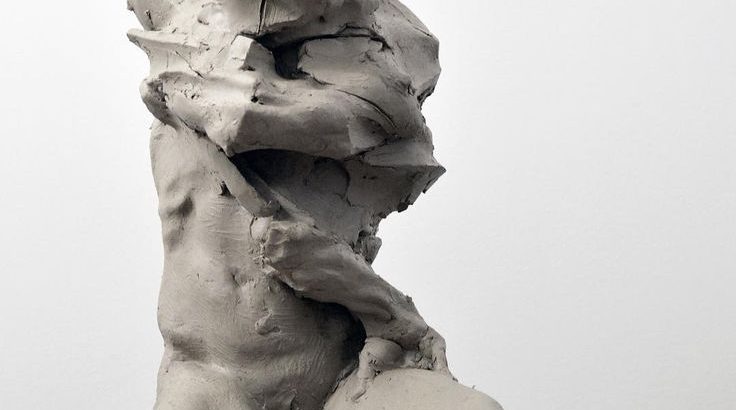
This screenshot has height=410, width=736. I want to click on chest, so pyautogui.click(x=283, y=72).